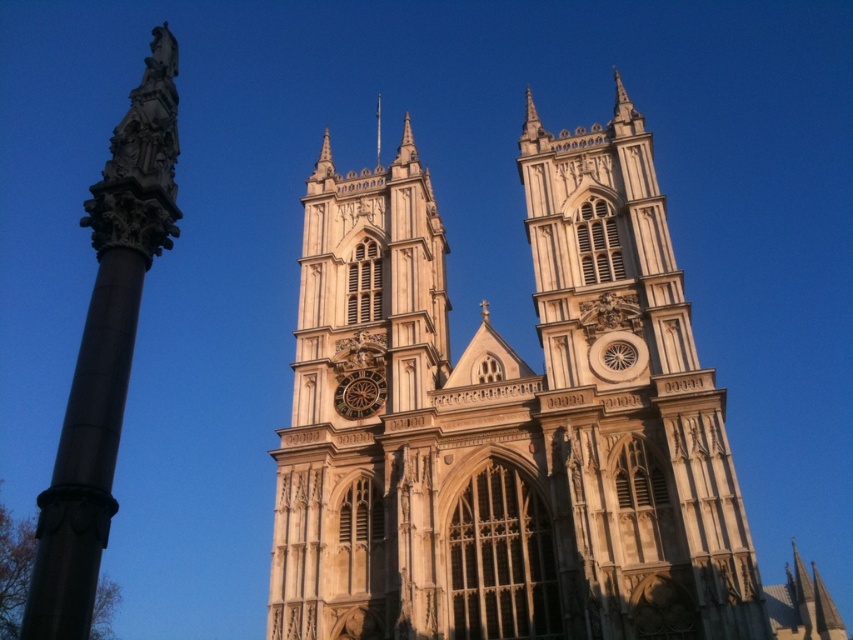
Question: Which object appears closest to the camera in this image?

Choices:
 (A) beige stone church at center
 (B) white stone spire at upper center

Answer: (A)

Question: Does beige stone church at center come in front of polished stone column at left?

Choices:
 (A) yes
 (B) no

Answer: (B)

Question: Which point is closer to the camera taking this photo?

Choices:
 (A) (x=44, y=506)
 (B) (x=631, y=355)
 (C) (x=346, y=396)

Answer: (A)

Question: Is polished stone column at left to the right of white stone spire at upper center from the viewer's perspective?

Choices:
 (A) no
 (B) yes

Answer: (A)

Question: Considering the relative positions of golden stone clock at center and white stone spire at upper center in the image provided, where is golden stone clock at center located with respect to white stone spire at upper center?

Choices:
 (A) right
 (B) left

Answer: (A)

Question: Which point is closer to the camera?

Choices:
 (A) (44, 545)
 (B) (376, 154)
 (C) (347, 403)
 (D) (527, 520)

Answer: (A)